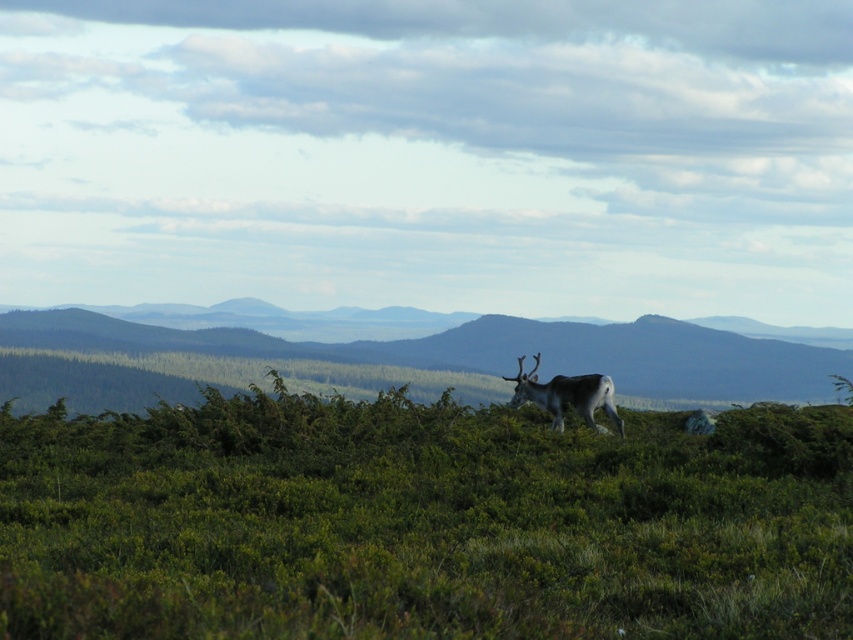
Does green grassy hillside at center appear over grayish-brown fur deer at center?

No.

Is the position of green grassy hillside at center less distant than that of grayish-brown fur deer at center?

No.

Locate an element on the screen. The width and height of the screenshot is (853, 640). green grassy hillside at center is located at coordinates (457, 355).

Where is `green grassy hillside at center`? This screenshot has height=640, width=853. green grassy hillside at center is located at coordinates (457, 355).